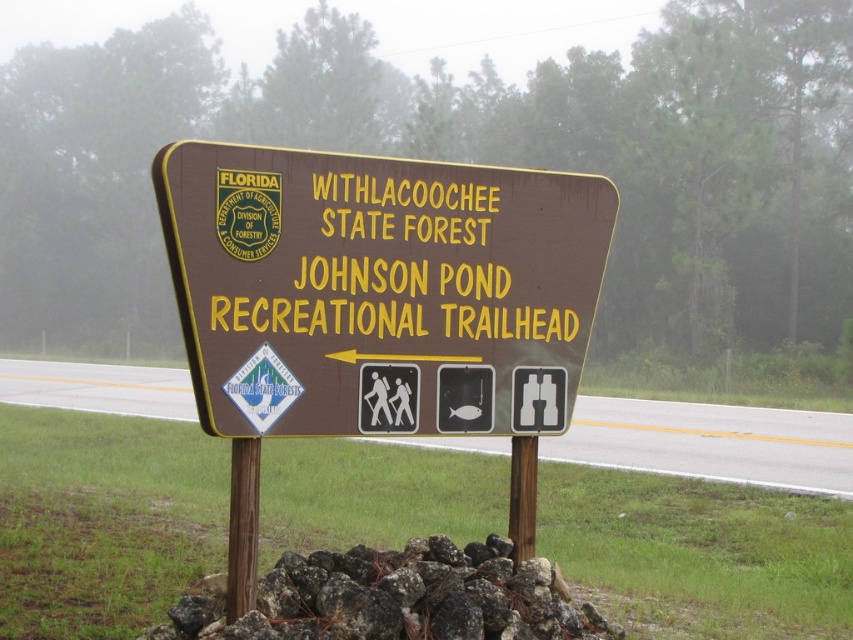
Question: Can you confirm if brown wooden sign at center is positioned to the left of dark gray rock at center?

Choices:
 (A) no
 (B) yes

Answer: (A)

Question: Among these points, which one is nearest to the camera?

Choices:
 (A) (816, 449)
 (B) (453, 253)

Answer: (B)

Question: Which of the following is the closest to the observer?

Choices:
 (A) (416, 618)
 (B) (798, 465)
 (C) (321, 300)

Answer: (C)

Question: Based on their relative distances, which object is farther from the brown wooden sign at center?

Choices:
 (A) dark gray rock at center
 (B) brown wooden signpost at center

Answer: (B)

Question: Does brown wooden signpost at center appear on the left side of dark gray rock at center?

Choices:
 (A) no
 (B) yes

Answer: (B)

Question: Is brown wooden sign at center positioned at the back of dark gray rock at center?

Choices:
 (A) no
 (B) yes

Answer: (A)